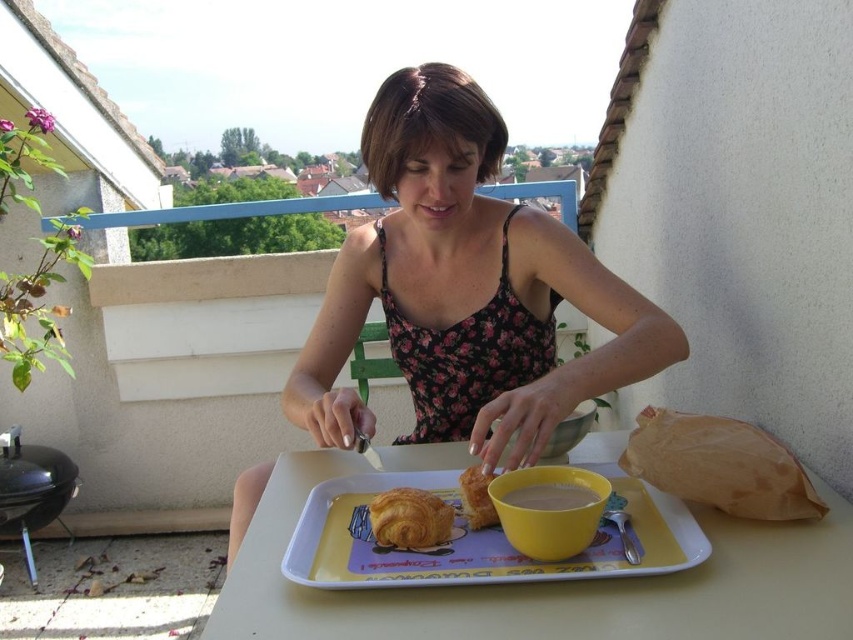
You are a delivery person standing on the balcony where the woman is eating. You need to place a small package on the table without disturbing her. The package is 10 inches long. Is there enough space between the floral fabric dress at center and the white plastic tray at center to place the package?

The distance between the floral fabric dress at center and the white plastic tray at center is 10.28 inches. Since the package is 10 inches long, there is just enough space to place it between them without disturbing the items.

You are standing in front of the table where the woman is eating. There are two points marked on the table. One is at coordinate point (547, 627) and the other is at point (384, 536). Which point is closer to you?

Point (547, 627) is closer to the viewer than point (384, 536).

You are standing in front of the white plastic tray at center. If you want to reach an object that is 25.60 inches away from you, can you reach it?

The white plastic tray at center is 25.60 inches away from the viewer, so if you want to reach an object at that distance, you can do so since it is within typical human reaching distance.